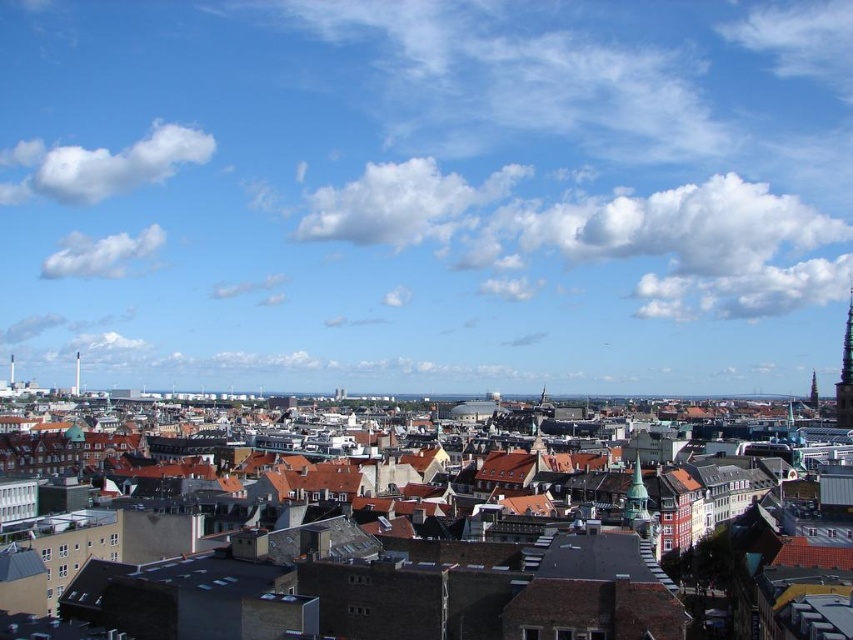
From the picture: You are standing in the city and want to reach a specific location marked by the point at coordinates (625, 520). If your walking speed is 1.5 meters per second, how many seconds will it take you to reach that point?

The point at coordinates (625, 520) is 168.28 meters away from the viewer. At a walking speed of 1.5 meters per second, it will take approximately 112 seconds to reach the point.

You are standing at the viewpoint and see two points marked in the cityscape. Which point is closer to you, point (637, 486) or point (850, 304)?

Point (637, 486) is in front of point (850, 304), so it is closer to you.

You are a city planner assessing the distance between two landmarks for a new pedestrian bridge. The green metallic tower at center and the dark gray stone tower at upper right are two potential endpoints. Given that the maximum allowable distance for the bridge is 200 meters, can the bridge be constructed between these two towers?

The green metallic tower at center and the dark gray stone tower at upper right are 187.96 meters apart, which is within the 200 meter limit. Therefore, the bridge can be constructed between these two towers.